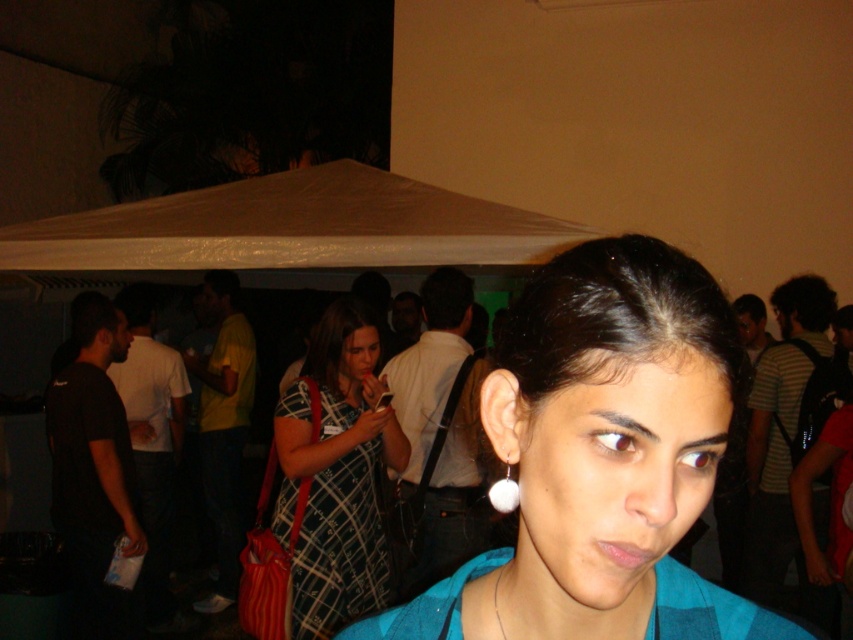
Question: Does teal fabric shirt at center have a larger size compared to plaid fabric dress at center?

Choices:
 (A) yes
 (B) no

Answer: (B)

Question: Is teal fabric shirt at center in front of plaid fabric dress at center?

Choices:
 (A) yes
 (B) no

Answer: (A)

Question: Which point is farther from the camera taking this photo?

Choices:
 (A) (347, 611)
 (B) (432, 541)

Answer: (B)

Question: Which point is closer to the camera?

Choices:
 (A) teal fabric shirt at center
 (B) white pearl earring at center
 (C) plaid fabric dress at center

Answer: (A)

Question: Is teal fabric shirt at center thinner than white pearl earring at center?

Choices:
 (A) yes
 (B) no

Answer: (A)

Question: Among these points, which one is farthest from the camera?

Choices:
 (A) (582, 264)
 (B) (318, 323)

Answer: (B)